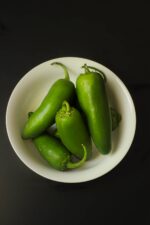
The width and height of the screenshot is (150, 225). Find the location of `white bowl`. white bowl is located at coordinates (97, 170).